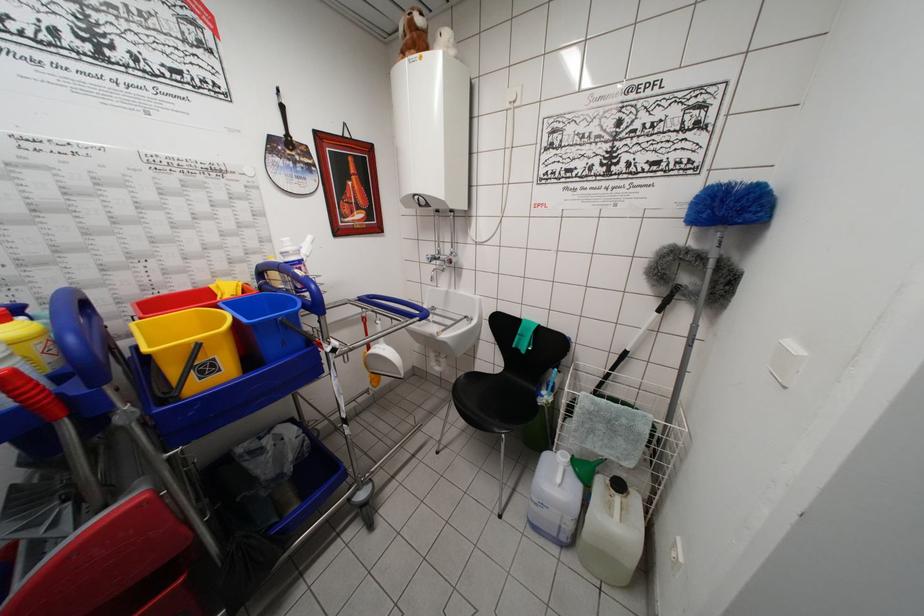
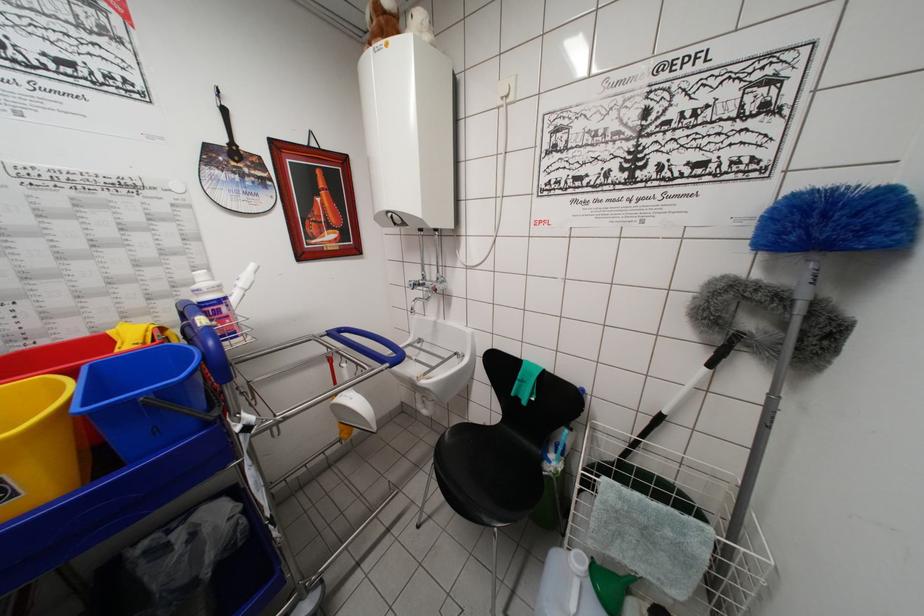
The point at (642,394) is marked in the first image. Where is the corresponding point in the second image?

(685, 469)